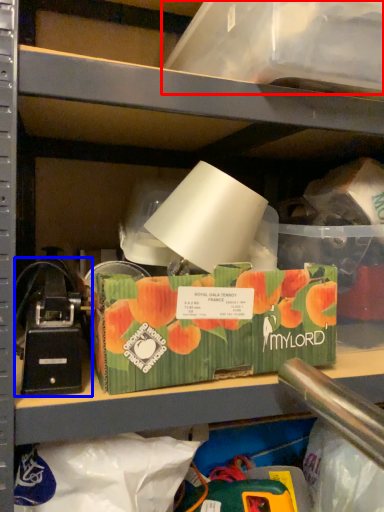
Question: Which object is closer to the camera taking this photo, storage box (highlighted by a red box) or toy (highlighted by a blue box)?

Choices:
 (A) storage box
 (B) toy

Answer: (A)